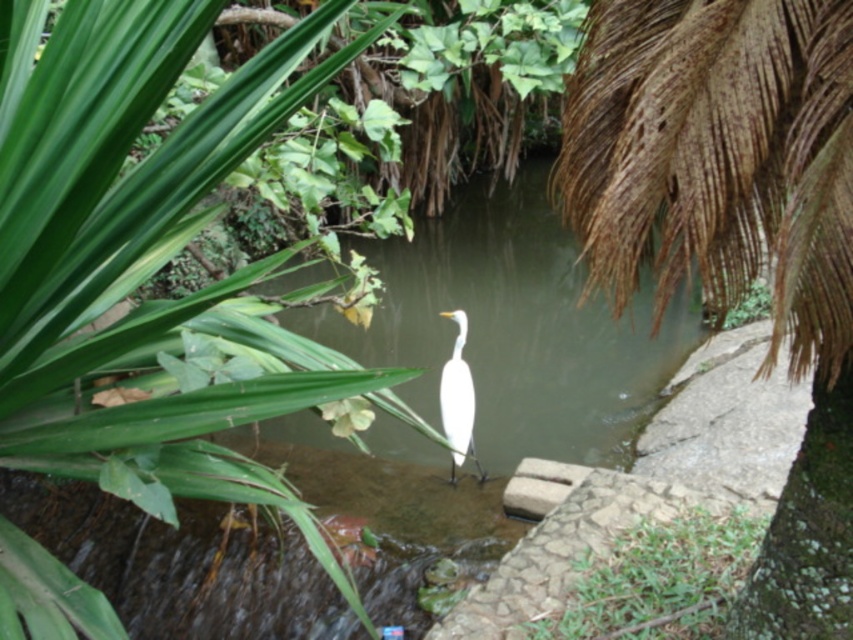
You are a photographer standing at the edge of the scene. You want to capture a photo where the green grass at lower center and the white smooth bird at center are both clearly visible. Based on their positions, which object is closer to you?

The green grass at lower center is closer to you since it is in front of the white smooth bird at center.